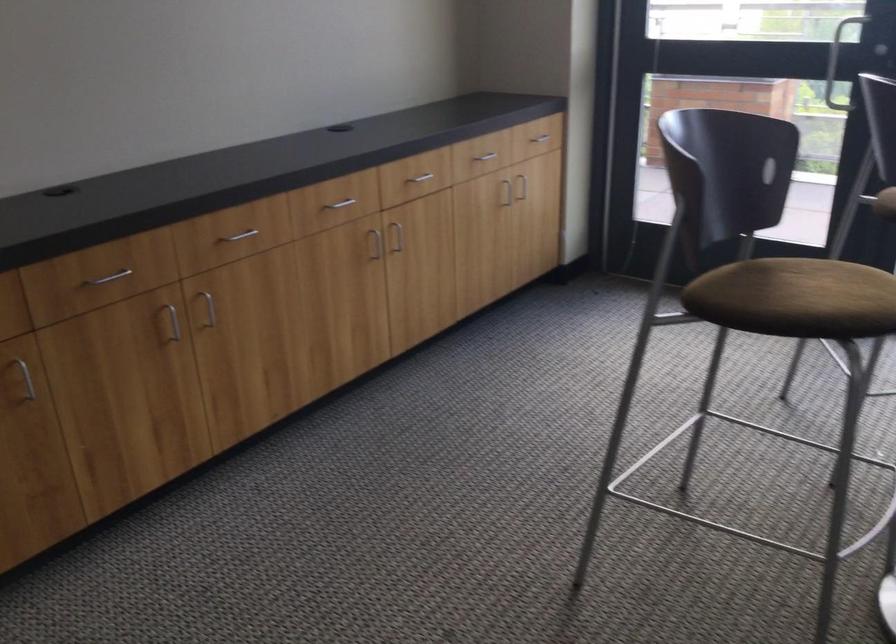
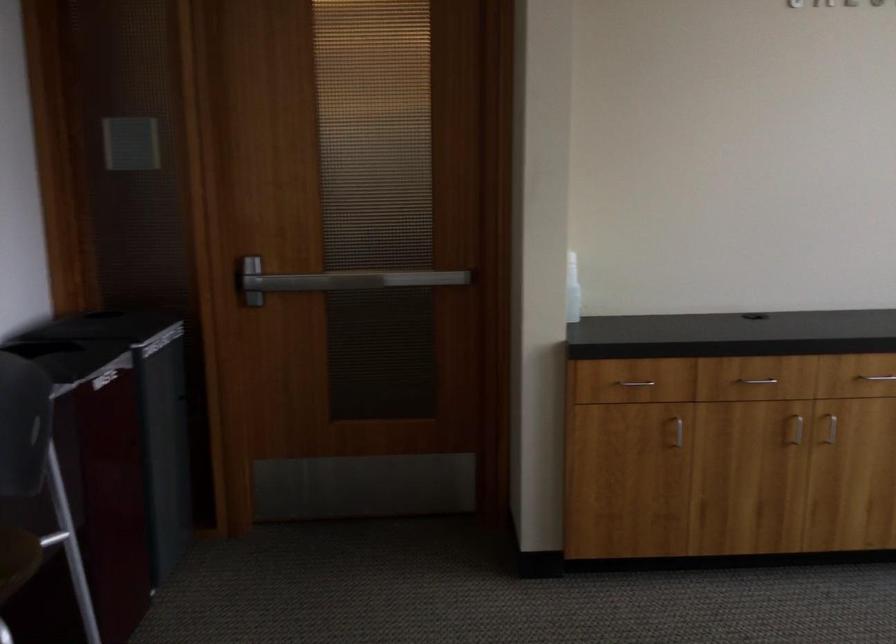
The point at (231, 242) is marked in the first image. Where is the corresponding point in the second image?

(874, 382)